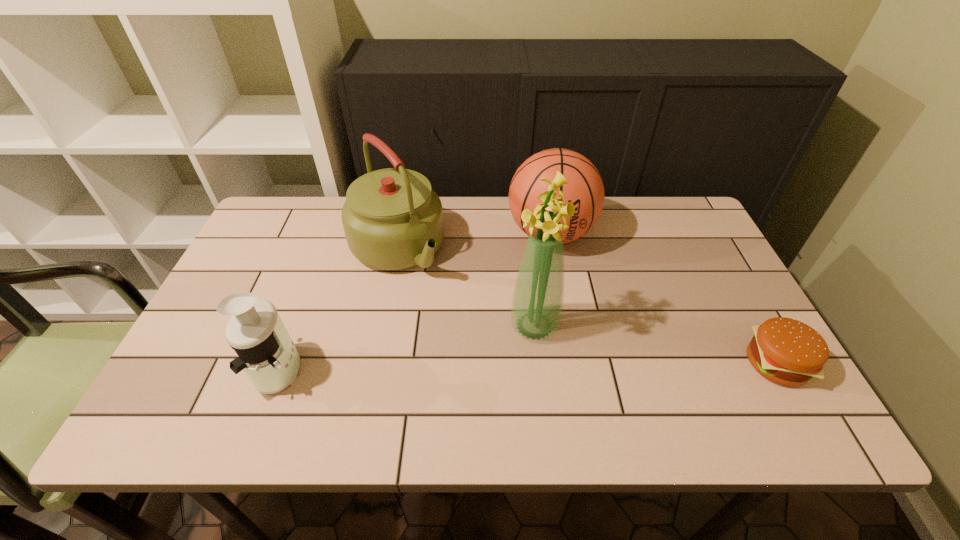
The width and height of the screenshot is (960, 540). I want to click on vacant spot on the desktop that is between the leftmost object and the hamburger and is positioned on the surface of the basketball near the brand logo, so click(557, 366).

This screenshot has width=960, height=540. I want to click on free space on the desktop that is between the juicer and the shortest object and is positioned on the front-facing side of the tallest object, so click(468, 367).

This screenshot has width=960, height=540. In order to click on free space on the desktop that is between the leftmost object and the hamburger and is positioned at the spout of the second object from left to right in this screenshot , I will do `click(503, 367)`.